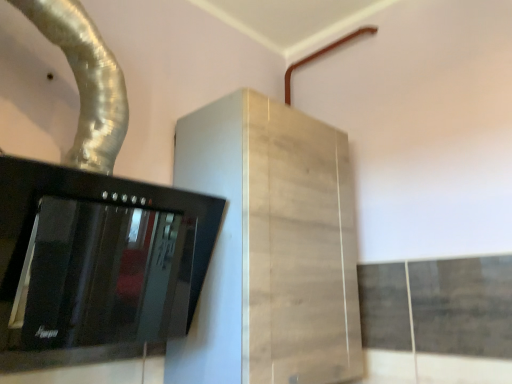
Question: In the image, is light wood cabinet at center on the left side or the right side of silver metallic duct at upper left?

Choices:
 (A) left
 (B) right

Answer: (B)

Question: In terms of width, does light wood cabinet at center look wider or thinner when compared to silver metallic duct at upper left?

Choices:
 (A) thin
 (B) wide

Answer: (B)

Question: Which object is the farthest from the silver metallic duct at upper left?

Choices:
 (A) black glass stove at left
 (B) light wood cabinet at center
 (C) brown matte pipe at upper right

Answer: (C)

Question: Which is farther from the black glass stove at left?

Choices:
 (A) silver metallic duct at upper left
 (B) light wood cabinet at center
 (C) brown matte pipe at upper right

Answer: (C)